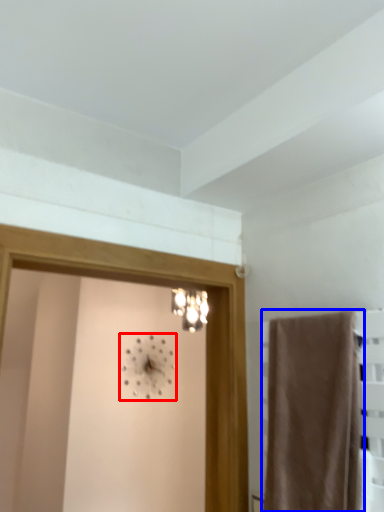
Question: Which object is closer to the camera taking this photo, clock (highlighted by a red box) or curtain (highlighted by a blue box)?

Choices:
 (A) clock
 (B) curtain

Answer: (B)